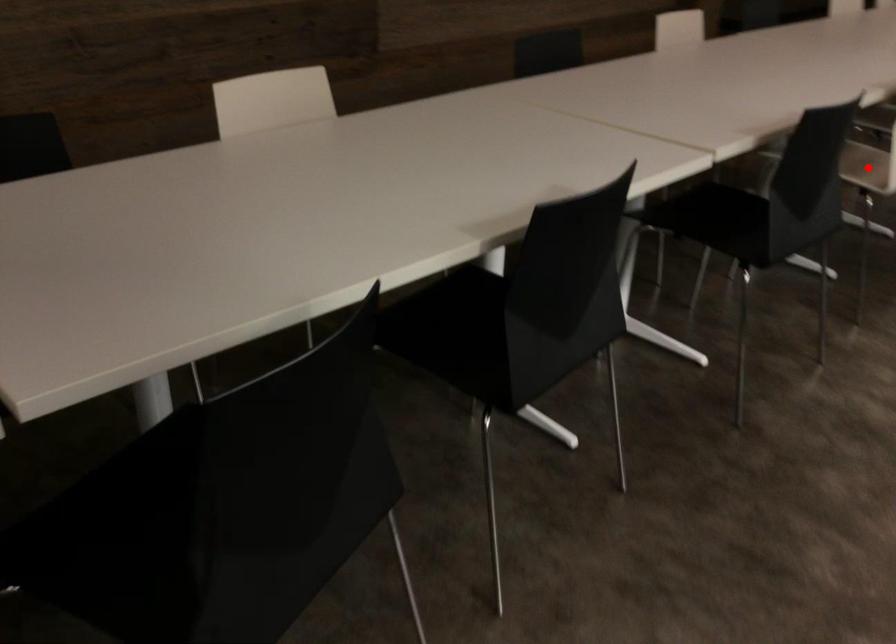
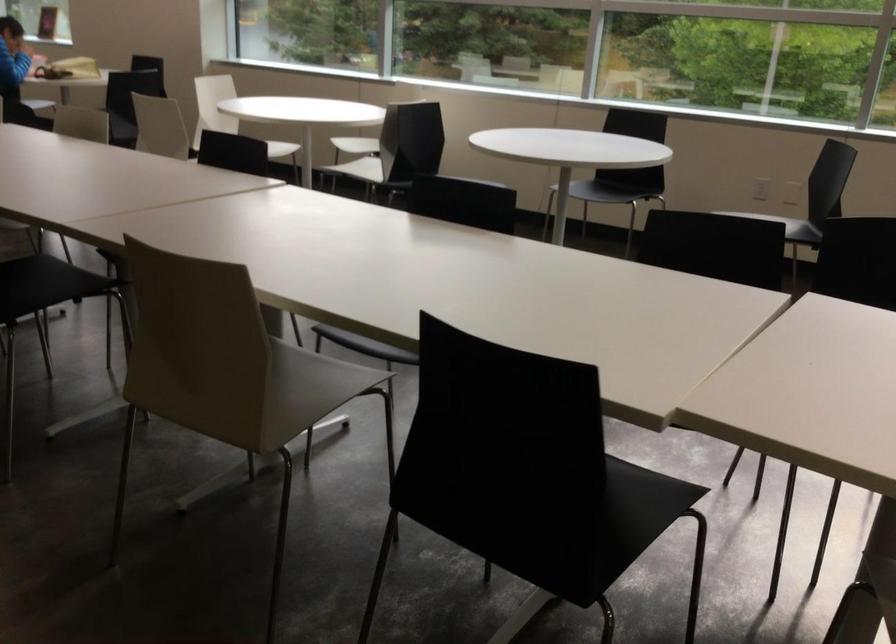
Question: I am providing you with two images of the same scene from different viewpoints. A red point is marked on the first image. At the location where the point appears in image 1, is it still visible in image 2?

Choices:
 (A) Yes
 (B) No

Answer: (B)